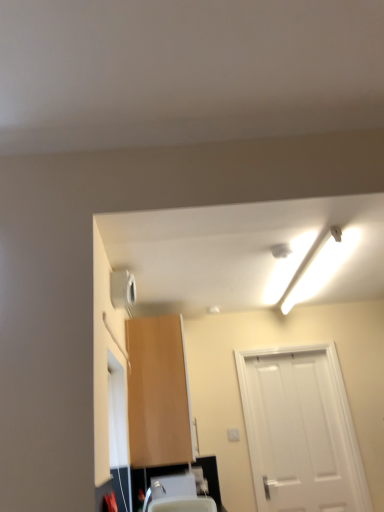
Question: From the image's perspective, is light brown wood cabinet at center beneath white matte door at right?

Choices:
 (A) no
 (B) yes

Answer: (A)

Question: From a real-world perspective, is light brown wood cabinet at center below white matte door at right?

Choices:
 (A) no
 (B) yes

Answer: (A)

Question: Is light brown wood cabinet at center touching white matte door at right?

Choices:
 (A) yes
 (B) no

Answer: (B)

Question: From the image's perspective, is light brown wood cabinet at center above white matte door at right?

Choices:
 (A) no
 (B) yes

Answer: (B)

Question: Is light brown wood cabinet at center further to the viewer compared to white matte door at right?

Choices:
 (A) yes
 (B) no

Answer: (B)

Question: Considering their positions, is white plastic sink at lower center located in front of or behind light brown wood cabinet at center?

Choices:
 (A) front
 (B) behind

Answer: (A)

Question: Does point (180, 480) appear closer or farther from the camera than point (142, 462)?

Choices:
 (A) farther
 (B) closer

Answer: (A)

Question: From a real-world perspective, is white plastic sink at lower center positioned above or below light brown wood cabinet at center?

Choices:
 (A) above
 (B) below

Answer: (B)

Question: Based on their positions, is white plastic sink at lower center located to the left or right of light brown wood cabinet at center?

Choices:
 (A) left
 (B) right

Answer: (B)

Question: From their relative heights in the image, would you say satin nickel faucet at lower center is taller or shorter than white plastic sink at lower center?

Choices:
 (A) short
 (B) tall

Answer: (A)

Question: Is satin nickel faucet at lower center spatially inside white plastic sink at lower center, or outside of it?

Choices:
 (A) inside
 (B) outside

Answer: (B)

Question: In terms of width, does satin nickel faucet at lower center look wider or thinner when compared to white plastic sink at lower center?

Choices:
 (A) thin
 (B) wide

Answer: (A)

Question: From a real-world perspective, is satin nickel faucet at lower center physically located above or below white plastic sink at lower center?

Choices:
 (A) above
 (B) below

Answer: (A)

Question: In the image, is light brown wood cabinet at center positioned in front of or behind white fluorescent tube at upper right?

Choices:
 (A) front
 (B) behind

Answer: (B)

Question: Does point (157, 454) appear closer or farther from the camera than point (337, 267)?

Choices:
 (A) closer
 (B) farther

Answer: (A)